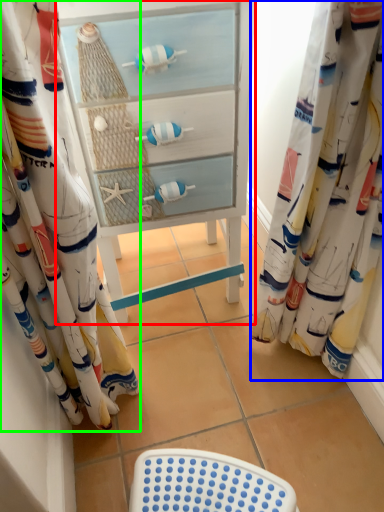
Question: Which object is the farthest from furniture (highlighted by a red box)? Choose among these: curtain (highlighted by a blue box) or curtain (highlighted by a green box).

Choices:
 (A) curtain
 (B) curtain

Answer: (A)